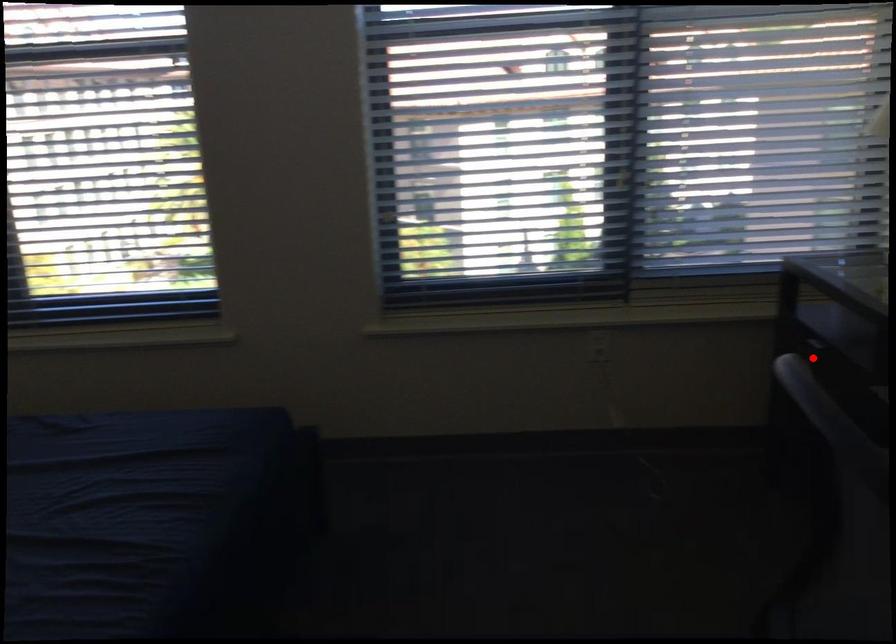
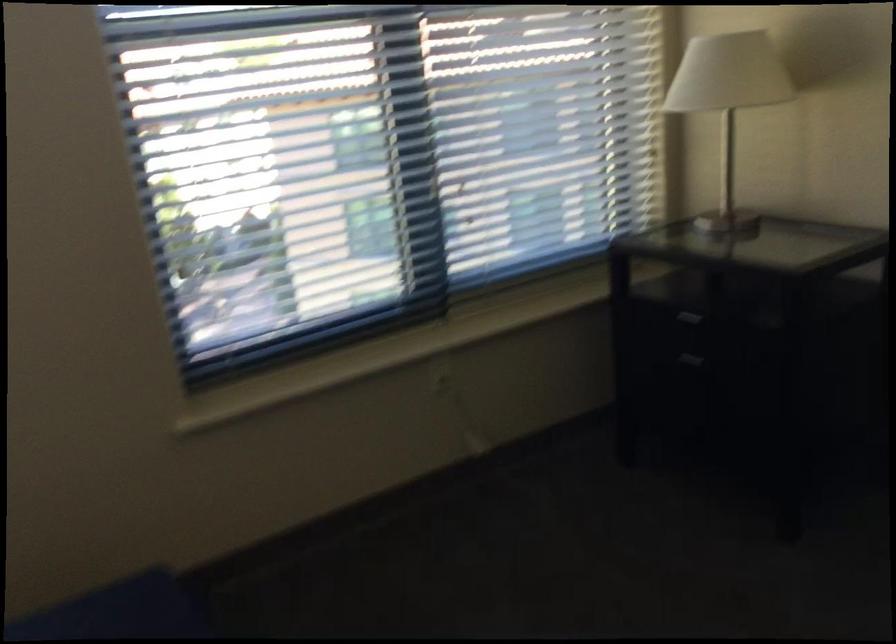
Find the pixel in the second image that matches the highlighted location in the first image.

(682, 330)